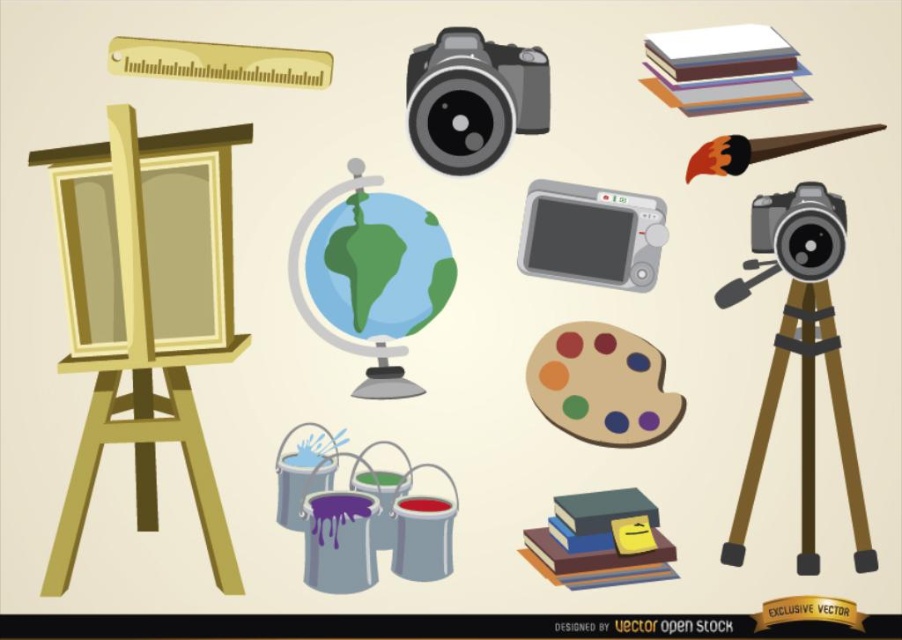
Question: Is wooden easel at left to the left of gray plastic camera at center from the viewer's perspective?

Choices:
 (A) yes
 (B) no

Answer: (A)

Question: Which object is closer to the camera taking this photo?

Choices:
 (A) matte black camera at upper center
 (B) matte plastic palette at center

Answer: (A)

Question: Can you confirm if matte black camera at upper center is bigger than gray plastic camera at center?

Choices:
 (A) yes
 (B) no

Answer: (A)

Question: Which point appears farthest from the camera in this image?

Choices:
 (A) (494, 49)
 (B) (807, 518)
 (C) (199, 228)

Answer: (A)

Question: Does matte black camera at upper center come behind matte plastic palette at center?

Choices:
 (A) yes
 (B) no

Answer: (B)

Question: Which object is closer to the camera taking this photo?

Choices:
 (A) brown matte tripod at right
 (B) matte black camera at upper center
 (C) gray plastic camera at center
 (D) matte black camera at upper right

Answer: (D)